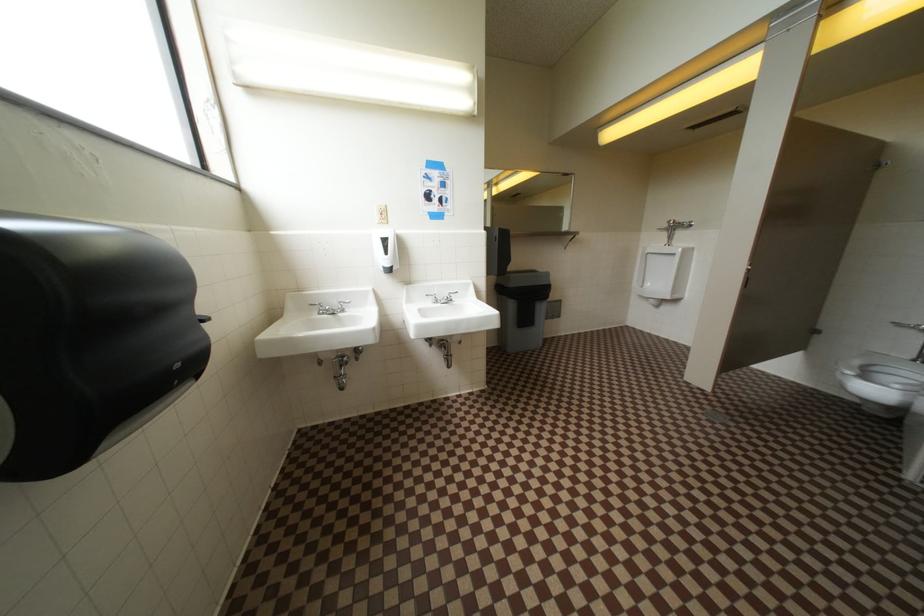
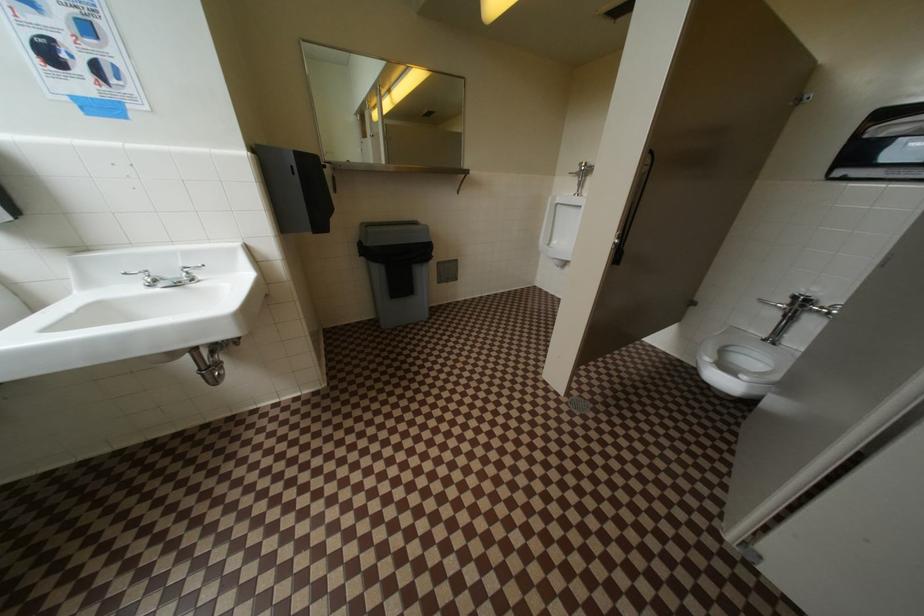
Question: The images are taken continuously from a first-person perspective. In which direction is your viewpoint rotating?

Choices:
 (A) Left
 (B) Right
 (C) Up
 (D) Down

Answer: (D)